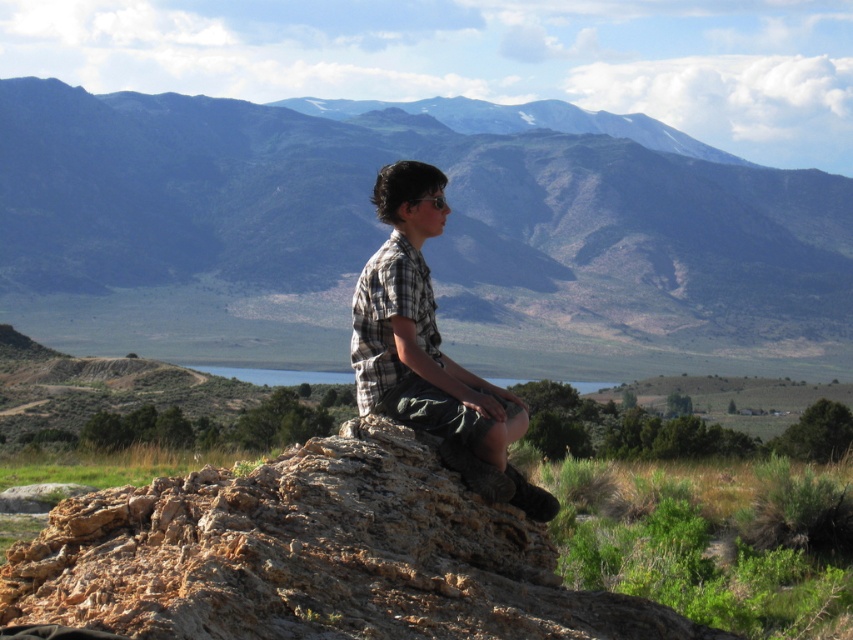
Does point (126, 316) come closer to viewer compared to point (294, 369)?

No.

Who is more distant from viewer, (230, 202) or (258, 369)?

Point (230, 202)

Locate an element on the screen. The image size is (853, 640). green grassy mountain at center is located at coordinates tap(386, 232).

Where is `green grassy mountain at center`? green grassy mountain at center is located at coordinates (x=386, y=232).

Is plaid shirt at center below blue glass lake at center?

No.

Which is below, plaid shirt at center or blue glass lake at center?

blue glass lake at center is lower down.

Where is `plaid shirt at center`? The image size is (853, 640). plaid shirt at center is located at coordinates (428, 349).

Where is `plaid shirt at center`? plaid shirt at center is located at coordinates (428, 349).

Which is behind, point (421, 586) or point (506, 481)?

The point (506, 481) is behind.

Is point (575, 628) positioned before point (405, 280)?

Yes, it is in front of point (405, 280).

You are a GUI agent. You are given a task and a screenshot of the screen. Output one action in this format:
    pyautogui.click(x=<x>, y=<y>)
    Task: Click on the brown rough rock at center
    
    Given the screenshot: What is the action you would take?
    pyautogui.click(x=312, y=556)